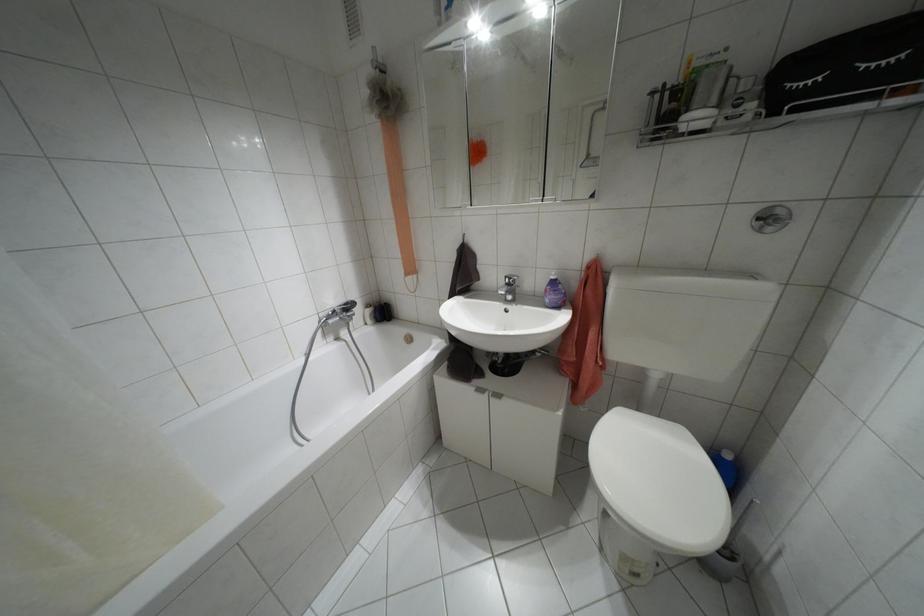
Where is `soap dispenser pump`? This screenshot has width=924, height=616. soap dispenser pump is located at coordinates (369, 315).